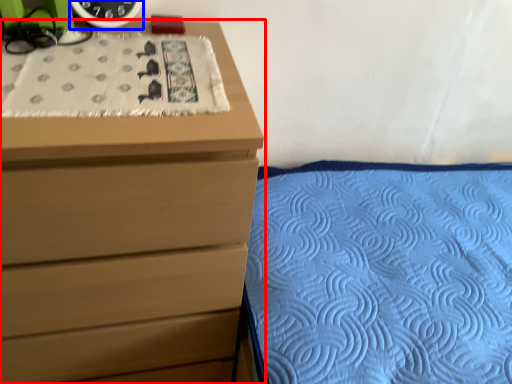
Question: Which point is further to the camera, chest of drawers (highlighted by a red box) or clock (highlighted by a blue box)?

Choices:
 (A) chest of drawers
 (B) clock

Answer: (B)